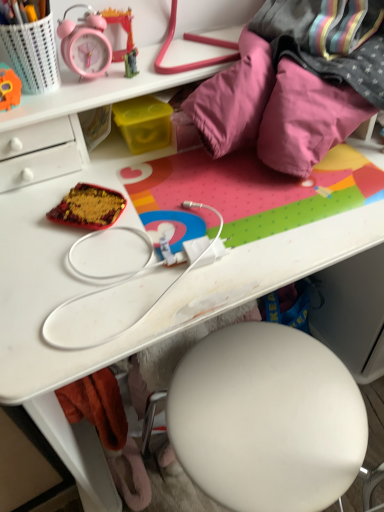
The image size is (384, 512). I want to click on yellow plastic container at center, which is the 3th stationery in left-to-right order, so click(143, 123).

What is the approximate width of matte plastic pencil case at upper left, the 1th stationery in the left-to-right sequence?

matte plastic pencil case at upper left, the 1th stationery in the left-to-right sequence, is 3.15 inches in width.

Identify the location of orange plush toy at upper left. The width and height of the screenshot is (384, 512). (9, 88).

The height and width of the screenshot is (512, 384). What are the coordinates of `yellow plastic container at center, which is the 3th stationery in left-to-right order` in the screenshot? It's located at (143, 123).

Looking at their sizes, would you say matte plastic pencil case at upper left, the 1th stationery in the left-to-right sequence, is wider or thinner than orange plush toy at upper left?

Considering their sizes, matte plastic pencil case at upper left, the 1th stationery in the left-to-right sequence, looks broader than orange plush toy at upper left.

Is matte plastic pencil case at upper left, the third stationery from the right, taller or shorter than orange plush toy at upper left?

matte plastic pencil case at upper left, the third stationery from the right, is taller than orange plush toy at upper left.

Is matte plastic pencil case at upper left, the third stationery from the right, bigger than orange plush toy at upper left?

Yes.

From the image's perspective, between matte plastic pencil case at upper left, the 1th stationery in the left-to-right sequence, and orange plush toy at upper left, who is located below?

From the image's view, orange plush toy at upper left is below.

Is orange plush toy at upper left located within yellow plastic container at center, the 1th stationery viewed from the right?

That's incorrect, orange plush toy at upper left is not inside yellow plastic container at center, the 1th stationery viewed from the right.

Is yellow plastic container at center, the 1th stationery viewed from the right, bigger than orange plush toy at upper left?

Correct, yellow plastic container at center, the 1th stationery viewed from the right, is larger in size than orange plush toy at upper left.

Is yellow plastic container at center, the 1th stationery viewed from the right, directly adjacent to orange plush toy at upper left?

No, yellow plastic container at center, the 1th stationery viewed from the right, is not next to orange plush toy at upper left.

Who is taller, yellow plastic container at center, the 1th stationery viewed from the right, or orange plush toy at upper left?

yellow plastic container at center, the 1th stationery viewed from the right, is taller.

In the image, is matte plastic pencil case at upper left, the third stationery from the right, positioned in front of or behind shiny red fabric at center?

Visually, matte plastic pencil case at upper left, the third stationery from the right, is located in front of shiny red fabric at center.

Would you say matte plastic pencil case at upper left, the third stationery from the right, is to the left or to the right of shiny red fabric at center in the picture?

matte plastic pencil case at upper left, the third stationery from the right, is to the left of shiny red fabric at center.

Is matte plastic pencil case at upper left, the third stationery from the right, facing towards shiny red fabric at center?

No.

Between point (45, 63) and point (86, 214), which one is positioned behind?

The point (45, 63) is more distant.

In the scene shown: Is matte plastic alarm clock at upper left, the 2th stationery from the left, wider than orange plush toy at upper left?

Indeed, matte plastic alarm clock at upper left, the 2th stationery from the left, has a greater width compared to orange plush toy at upper left.

Can you confirm if matte plastic alarm clock at upper left, the 2th stationery from the left, is positioned to the right of orange plush toy at upper left?

Yes.

Are matte plastic alarm clock at upper left, placed as the second stationery when sorted from right to left, and orange plush toy at upper left making contact?

No, matte plastic alarm clock at upper left, placed as the second stationery when sorted from right to left, is not making contact with orange plush toy at upper left.

Which of these two, matte plastic alarm clock at upper left, placed as the second stationery when sorted from right to left, or orange plush toy at upper left, is bigger?

matte plastic alarm clock at upper left, placed as the second stationery when sorted from right to left, is bigger.

Is point (123, 20) closer to viewer compared to point (164, 135)?

No.

From a real-world perspective, which is physically below, matte plastic alarm clock at upper left, placed as the second stationery when sorted from right to left, or yellow plastic container at center, the 1th stationery viewed from the right?

yellow plastic container at center, the 1th stationery viewed from the right, from a real-world perspective.

Is the surface of matte plastic alarm clock at upper left, the 2th stationery from the left, in direct contact with yellow plastic container at center, the 1th stationery viewed from the right?

No, matte plastic alarm clock at upper left, the 2th stationery from the left, is not next to yellow plastic container at center, the 1th stationery viewed from the right.

The width and height of the screenshot is (384, 512). What are the coordinates of `stationery to the right of matte plastic alarm clock at upper left, placed as the second stationery when sorted from right to left` in the screenshot? It's located at (143, 123).

Which object is further away from the camera taking this photo, matte plastic pencil case at upper left, the 1th stationery in the left-to-right sequence, or matte plastic alarm clock at upper left, placed as the second stationery when sorted from right to left?

matte plastic alarm clock at upper left, placed as the second stationery when sorted from right to left, is behind.

Is matte plastic pencil case at upper left, the 1th stationery in the left-to-right sequence, at the left side of matte plastic alarm clock at upper left, the 2th stationery from the left?

Indeed, matte plastic pencil case at upper left, the 1th stationery in the left-to-right sequence, is positioned on the left side of matte plastic alarm clock at upper left, the 2th stationery from the left.

Considering the relative sizes of matte plastic pencil case at upper left, the third stationery from the right, and matte plastic alarm clock at upper left, placed as the second stationery when sorted from right to left, in the image provided, is matte plastic pencil case at upper left, the third stationery from the right, smaller than matte plastic alarm clock at upper left, placed as the second stationery when sorted from right to left,?

No, matte plastic pencil case at upper left, the third stationery from the right, is not smaller than matte plastic alarm clock at upper left, placed as the second stationery when sorted from right to left.

Measure the distance between matte plastic pencil case at upper left, the 1th stationery in the left-to-right sequence, and matte plastic alarm clock at upper left, placed as the second stationery when sorted from right to left.

matte plastic pencil case at upper left, the 1th stationery in the left-to-right sequence, is 3.45 inches away from matte plastic alarm clock at upper left, placed as the second stationery when sorted from right to left.

Between orange plush toy at upper left and matte plastic alarm clock at upper left, the 2th stationery from the left, which one has larger size?

With larger size is matte plastic alarm clock at upper left, the 2th stationery from the left.

Which point is more forward, [0,82] or [131,45]?

The point [0,82] is closer.

Which object is positioned more to the right, orange plush toy at upper left or matte plastic alarm clock at upper left, the 2th stationery from the left?

matte plastic alarm clock at upper left, the 2th stationery from the left.

From the image's perspective, would you say orange plush toy at upper left is shown under matte plastic alarm clock at upper left, placed as the second stationery when sorted from right to left?

Yes.

The height and width of the screenshot is (512, 384). In order to click on toy located on the left of matte plastic pencil case at upper left, the 1th stationery in the left-to-right sequence in this screenshot , I will do `click(9, 88)`.

Locate an element on the screen. toy in front of the yellow plastic container at center, the 1th stationery viewed from the right is located at coordinates (9, 88).

Based on their spatial positions, is matte plastic alarm clock at upper left, placed as the second stationery when sorted from right to left, or orange plush toy at upper left further from shiny red fabric at center?

Based on the image, matte plastic alarm clock at upper left, placed as the second stationery when sorted from right to left, appears to be further to shiny red fabric at center.

Based on their spatial positions, is yellow plastic container at center, the 1th stationery viewed from the right, or shiny red fabric at center further from orange plush toy at upper left?

The object further to orange plush toy at upper left is yellow plastic container at center, the 1th stationery viewed from the right.

From the image, which object appears to be farther from yellow plastic container at center, which is the 3th stationery in left-to-right order, shiny red fabric at center or matte plastic alarm clock at upper left, placed as the second stationery when sorted from right to left?

shiny red fabric at center.

Considering their positions, is matte plastic alarm clock at upper left, placed as the second stationery when sorted from right to left, positioned further to matte plastic pencil case at upper left, the 1th stationery in the left-to-right sequence, than shiny red fabric at center?

shiny red fabric at center.

When comparing their distances from shiny red fabric at center, does orange plush toy at upper left or matte plastic alarm clock at upper left, placed as the second stationery when sorted from right to left, seem closer?

orange plush toy at upper left lies closer to shiny red fabric at center than the other object.

Based on their spatial positions, is orange plush toy at upper left or matte plastic pencil case at upper left, the 1th stationery in the left-to-right sequence, further from yellow plastic container at center, which is the 3th stationery in left-to-right order?

Among the two, orange plush toy at upper left is located further to yellow plastic container at center, which is the 3th stationery in left-to-right order.

Considering their positions, is shiny red fabric at center positioned closer to matte plastic pencil case at upper left, the third stationery from the right, than yellow plastic container at center, which is the 3th stationery in left-to-right order?

Result: yellow plastic container at center, which is the 3th stationery in left-to-right order.

Which object lies further to the anchor point yellow plastic container at center, which is the 3th stationery in left-to-right order, matte plastic pencil case at upper left, the third stationery from the right, or orange plush toy at upper left?

Based on the image, orange plush toy at upper left appears to be further to yellow plastic container at center, which is the 3th stationery in left-to-right order.

The image size is (384, 512). What are the coordinates of `stationery that lies between matte plastic alarm clock at upper left, placed as the second stationery when sorted from right to left, and shiny red fabric at center from top to bottom` in the screenshot? It's located at (143, 123).

You are a GUI agent. You are given a task and a screenshot of the screen. Output one action in this format:
    pyautogui.click(x=<x>, y=<y>)
    Task: Click on the stationery between matte plastic pencil case at upper left, the third stationery from the right, and yellow plastic container at center, the 1th stationery viewed from the right, from front to back
    The height and width of the screenshot is (512, 384).
    Given the screenshot: What is the action you would take?
    pyautogui.click(x=95, y=42)

You are a GUI agent. You are given a task and a screenshot of the screen. Output one action in this format:
    pyautogui.click(x=<x>, y=<y>)
    Task: Click on the stuff located between orange plush toy at upper left and yellow plastic container at center, which is the 3th stationery in left-to-right order, in the left-right direction
    
    Given the screenshot: What is the action you would take?
    pyautogui.click(x=89, y=207)

Where is `toy between matte plastic pencil case at upper left, the third stationery from the right, and shiny red fabric at center vertically`? toy between matte plastic pencil case at upper left, the third stationery from the right, and shiny red fabric at center vertically is located at coordinates (9, 88).